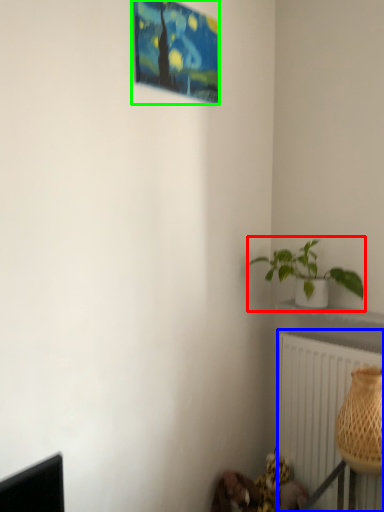
Question: Which object is positioned closest to houseplant (highlighted by a red box)? Select from radiator (highlighted by a blue box) and picture frame (highlighted by a green box).

Choices:
 (A) radiator
 (B) picture frame

Answer: (A)